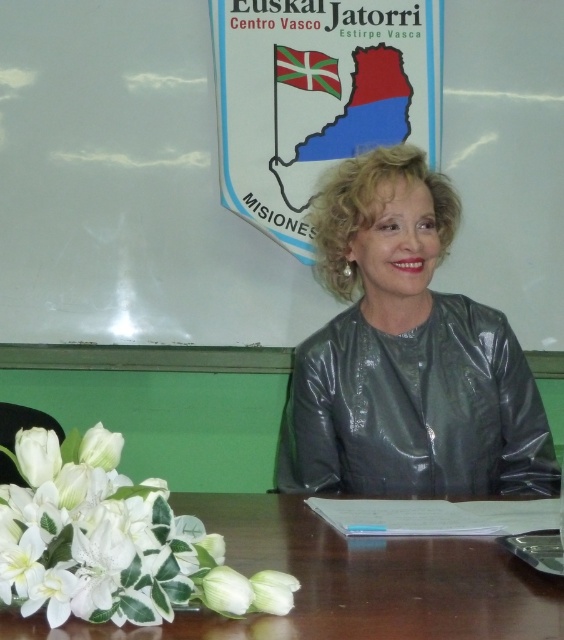
Question: Which of the following is the farthest from the observer?

Choices:
 (A) (250, 248)
 (B) (103, 632)
 (C) (105, 440)

Answer: (A)

Question: Can you confirm if whiteboard at upper center is thinner than white silk flowers at lower left?

Choices:
 (A) no
 (B) yes

Answer: (A)

Question: Is whiteboard at upper center above white silk flowers at lower left?

Choices:
 (A) no
 (B) yes

Answer: (B)

Question: Based on their relative distances, which object is nearer to the whiteboard at upper center?

Choices:
 (A) leather jacket at center
 (B) brown wooden table at lower center

Answer: (A)

Question: Is whiteboard at upper center smaller than leather jacket at center?

Choices:
 (A) yes
 (B) no

Answer: (A)

Question: Which of the following is the farthest from the observer?

Choices:
 (A) (350, 349)
 (B) (558, 612)
 (C) (244, 310)
 (D) (2, 589)

Answer: (C)